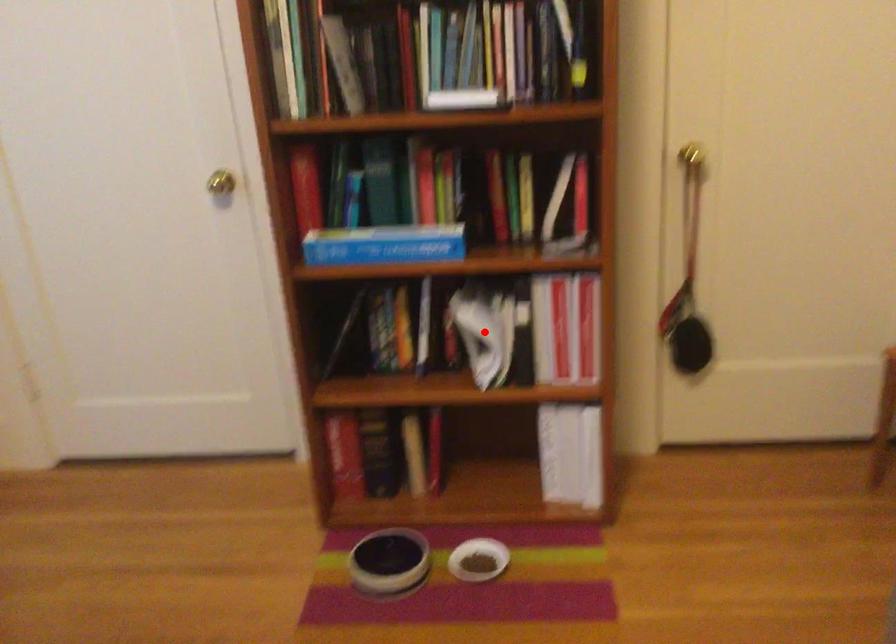
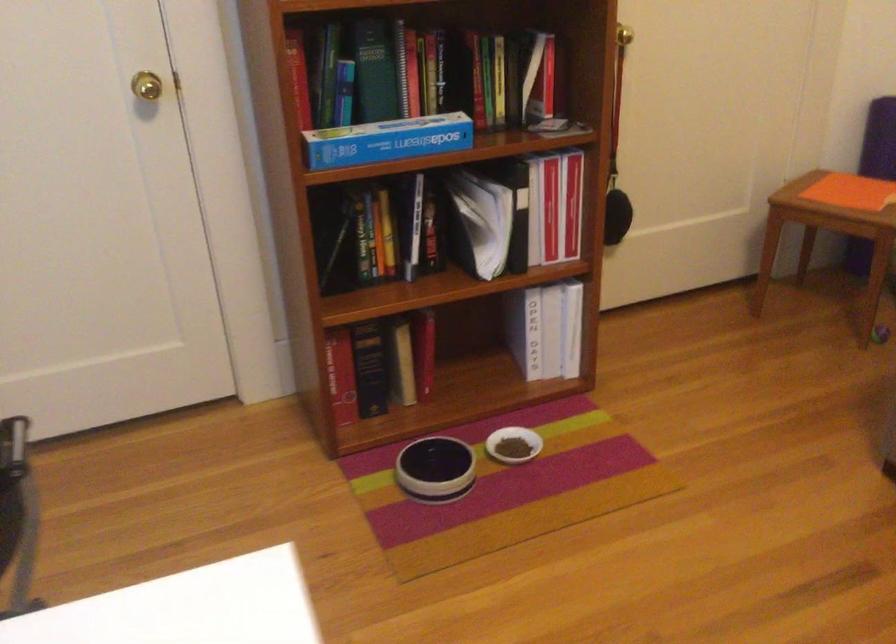
Locate, in the second image, the point that corresponds to the highlighted location in the first image.

(479, 222)